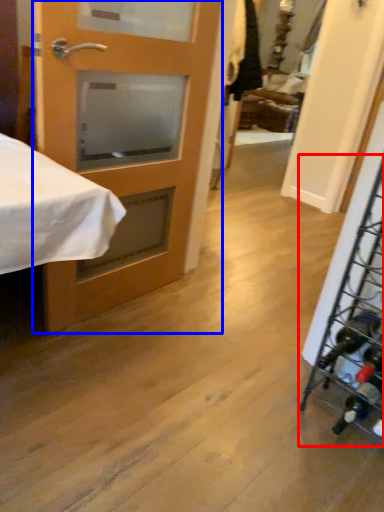
Question: Which object appears closest to the camera in this image, wine rack (highlighted by a red box) or door (highlighted by a blue box)?

Choices:
 (A) wine rack
 (B) door

Answer: (A)